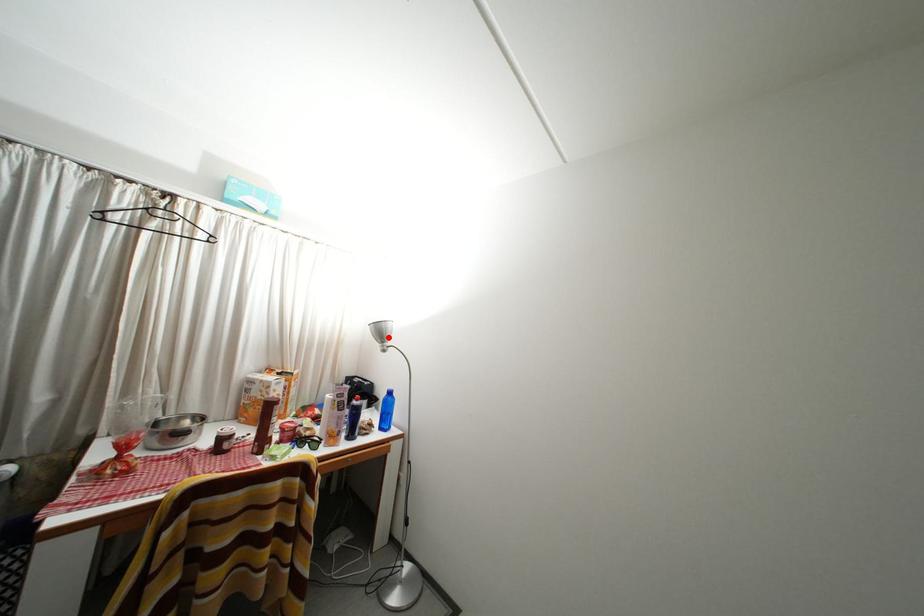
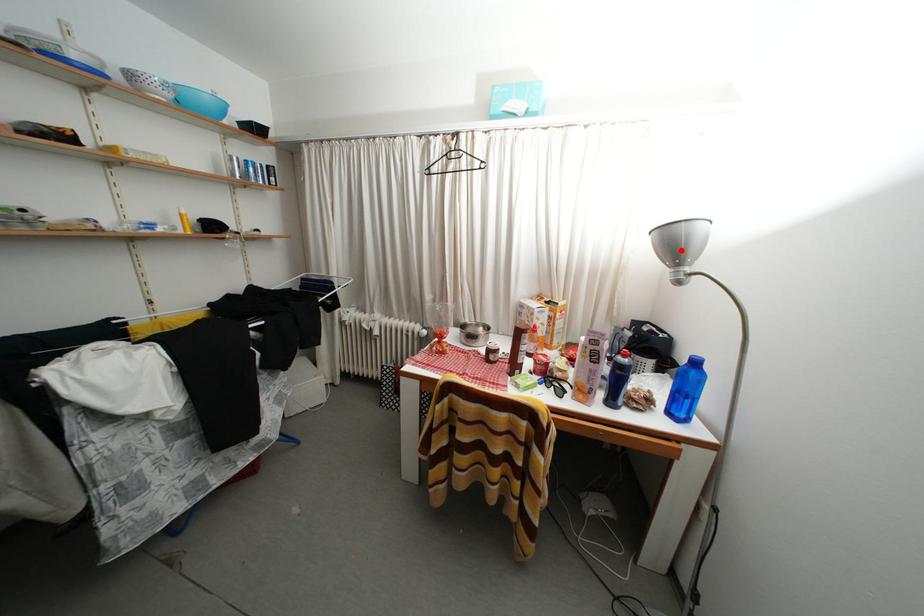
I am providing you with two images of the same scene from different viewpoints. A red point is marked on the first image and another point is marked on the second image. Is the marked point in image1 the same physical position as the marked point in image2?

Yes